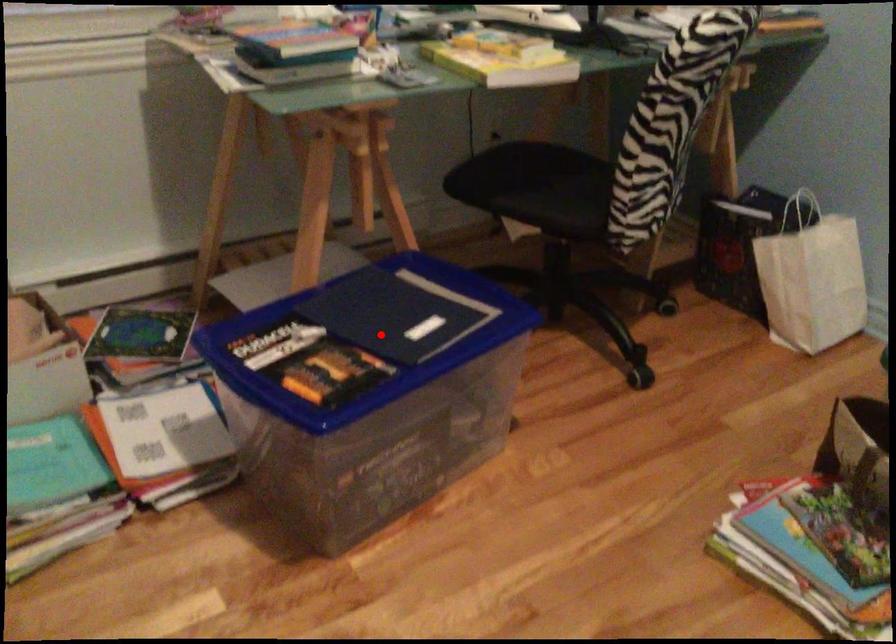
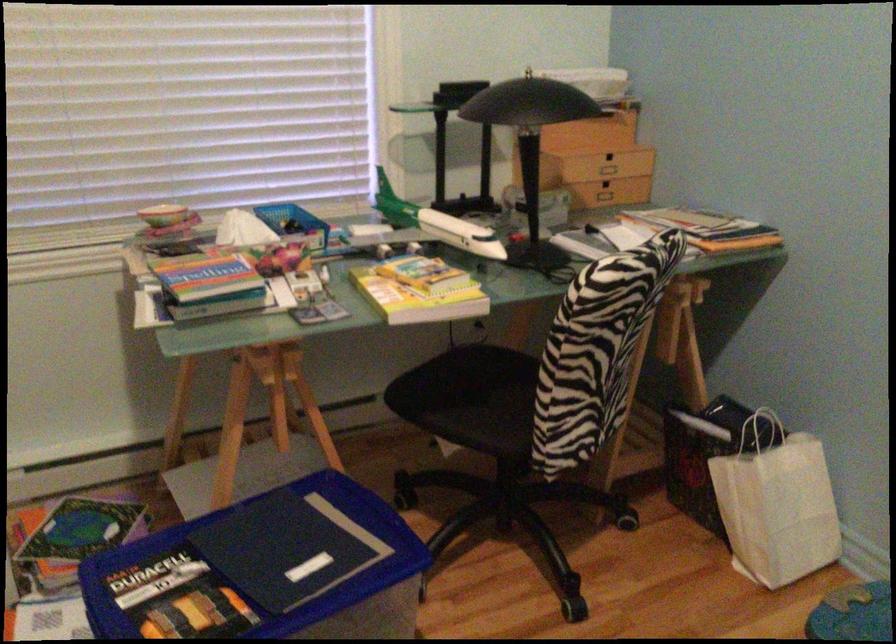
Find the pixel in the second image that matches the highlighted location in the first image.

(264, 570)